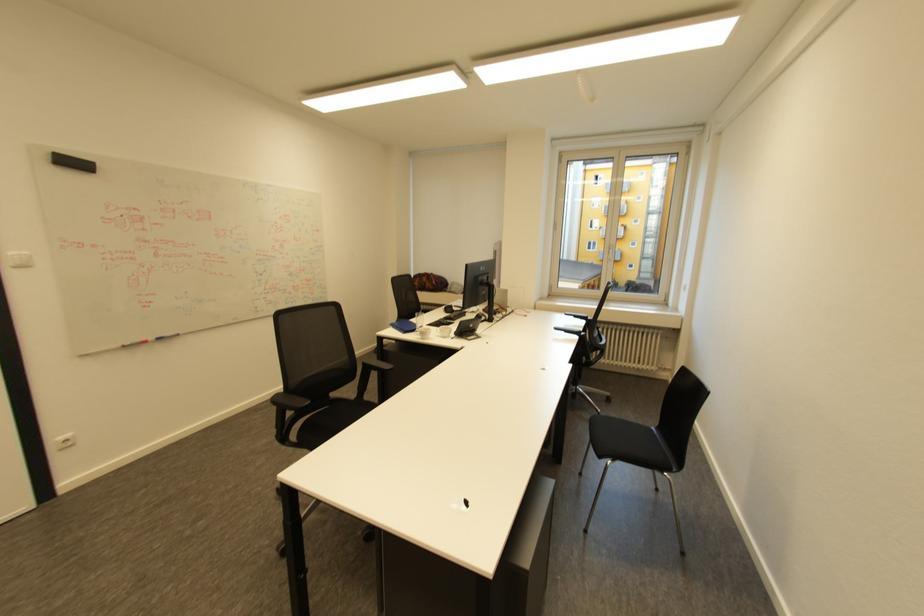
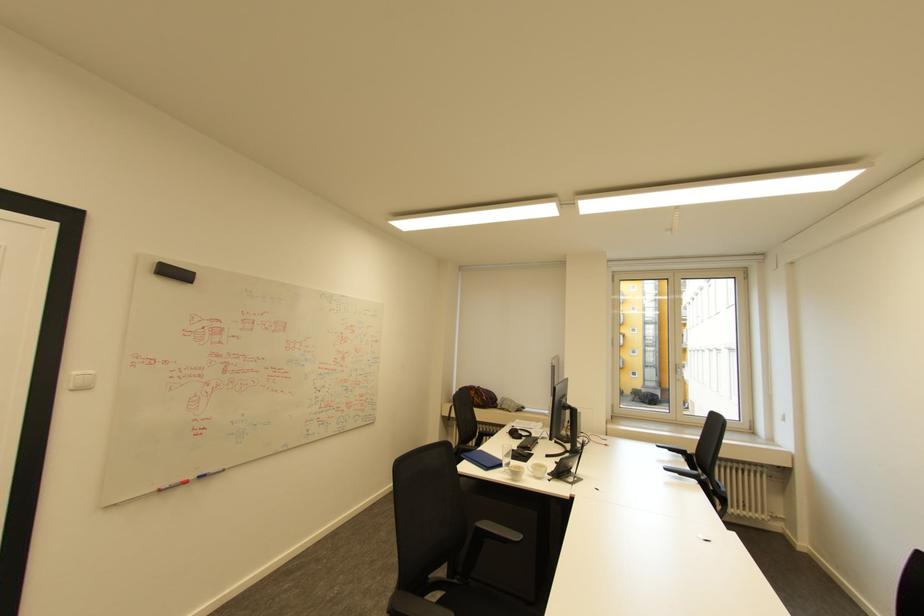
In the second image, find the point that corresponds to pixel 429 339 in the first image.

(518, 479)